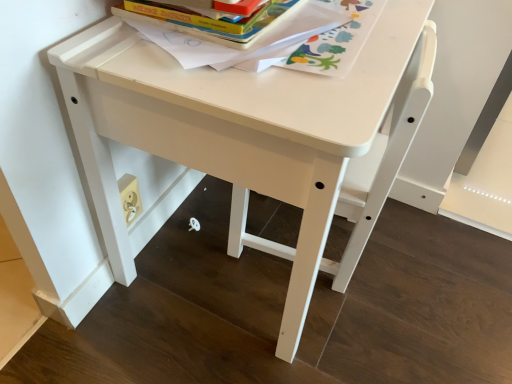
This screenshot has height=384, width=512. I want to click on vacant space situated above white matte table at center (from a real-world perspective), so click(x=286, y=39).